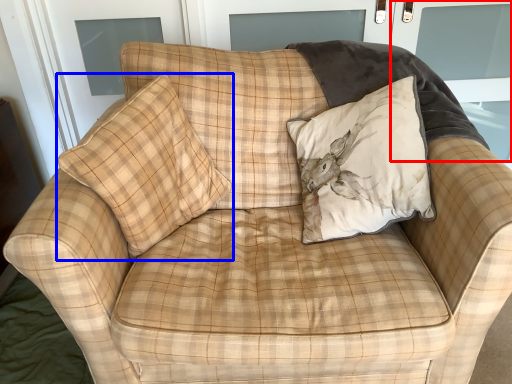
Question: Which object is closer to the camera taking this photo, screen door (highlighted by a red box) or pillow (highlighted by a blue box)?

Choices:
 (A) screen door
 (B) pillow

Answer: (B)